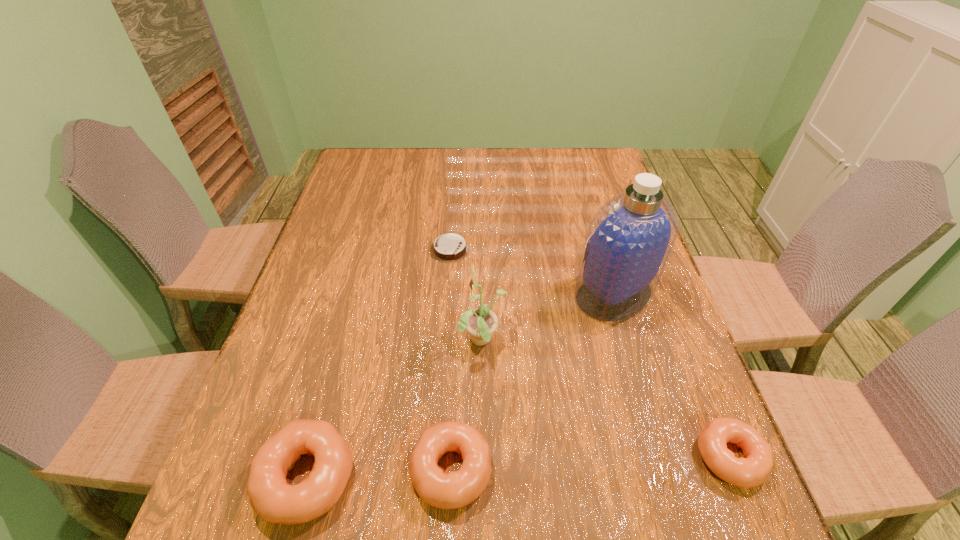
Where is `empty space that is in between the fifth tallest object and the sunflower`? This screenshot has height=540, width=960. empty space that is in between the fifth tallest object and the sunflower is located at coordinates (607, 400).

Identify the location of free space between the farthest object and the leftmost object. This screenshot has width=960, height=540. (378, 363).

Locate an element on the screen. The height and width of the screenshot is (540, 960). free spot between the rightmost doughnut and the leftmost object is located at coordinates (518, 467).

Identify the location of vacant space that is in between the cleansing agent and the second shortest object. The height and width of the screenshot is (540, 960). (672, 375).

Find the location of a particular element. free area in between the shortest doughnut and the second tallest object is located at coordinates point(607,400).

Where is `free space that is in between the rightmost doughnut and the tallest object`? free space that is in between the rightmost doughnut and the tallest object is located at coordinates (672, 375).

This screenshot has height=540, width=960. I want to click on free space between the rightmost doughnut and the sunflower, so click(x=607, y=400).

I want to click on object that is the fifth closest one to the rightmost doughnut, so click(x=448, y=248).

I want to click on the fourth closest object to the sunflower, so click(x=271, y=497).

Where is `doughnut that is the second closest to the leftmost object`? The height and width of the screenshot is (540, 960). doughnut that is the second closest to the leftmost object is located at coordinates (751, 471).